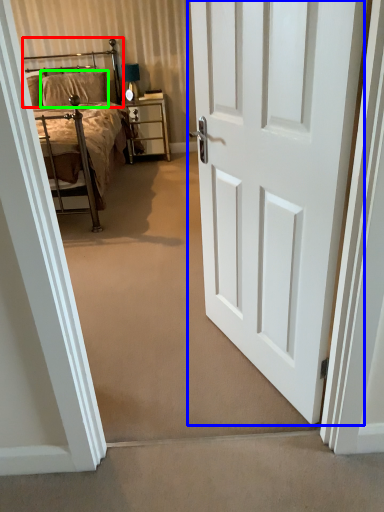
Question: Based on their relative distances, which object is nearer to headboard (highlighted by a red box)? Choose from door (highlighted by a blue box) and pillow (highlighted by a green box).

Choices:
 (A) door
 (B) pillow

Answer: (B)